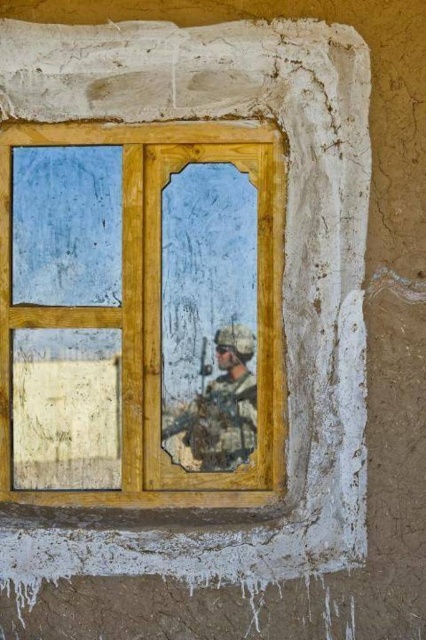
Which is more to the right, wooden window frame at center or camouflage fabric soldier at center?

camouflage fabric soldier at center is more to the right.

Does wooden window frame at center have a lesser width compared to camouflage fabric soldier at center?

No, wooden window frame at center is not thinner than camouflage fabric soldier at center.

Image resolution: width=426 pixels, height=640 pixels. In order to click on wooden window frame at center in this screenshot , I will do `click(141, 314)`.

The width and height of the screenshot is (426, 640). I want to click on wooden window frame at center, so point(141,314).